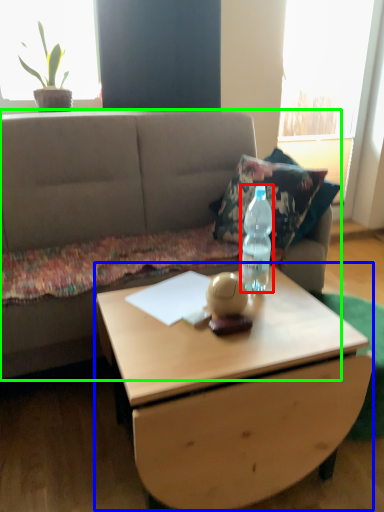
Question: Which is farther away from bottle (highlighted by a red box)? coffee table (highlighted by a blue box) or studio couch (highlighted by a green box)?

Choices:
 (A) coffee table
 (B) studio couch

Answer: (B)